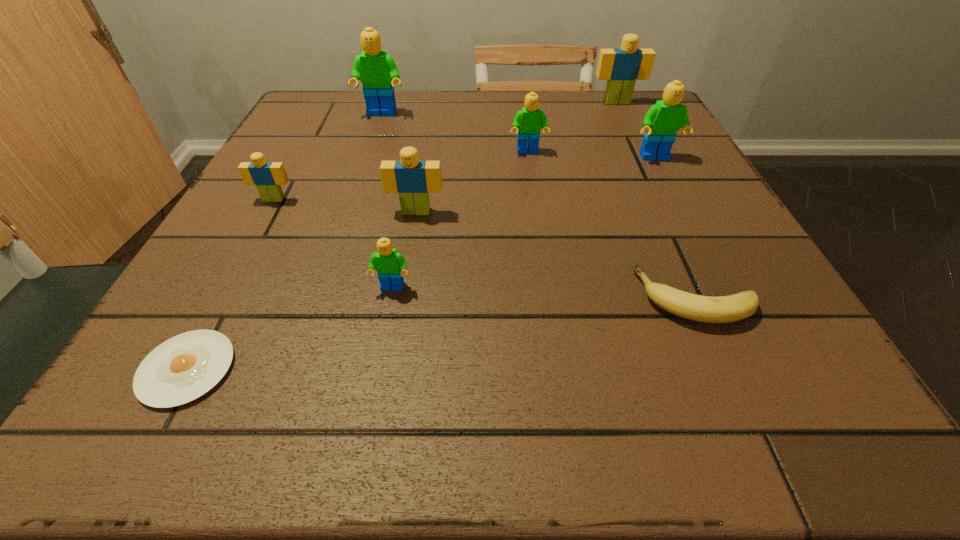
Where is `object situated at the near left corner`? The image size is (960, 540). object situated at the near left corner is located at coordinates (183, 368).

Image resolution: width=960 pixels, height=540 pixels. Find the location of `object that is at the far right corner`. object that is at the far right corner is located at coordinates (621, 67).

Find the location of a particular element. The height and width of the screenshot is (540, 960). vacant space at the far edge of the desktop is located at coordinates (416, 132).

Identify the location of free space at the near edge of the desktop. (638, 420).

The width and height of the screenshot is (960, 540). I want to click on free space at the right edge, so click(780, 319).

At what (x,y) coordinates should I click in order to perform the action: click on vacant space at the far left corner of the desktop. Please return your answer as a coordinate pair (x, y). This screenshot has width=960, height=540. Looking at the image, I should click on (343, 116).

Where is `vacant position at the near left corner of the desktop`? This screenshot has width=960, height=540. vacant position at the near left corner of the desktop is located at coordinates (135, 405).

Image resolution: width=960 pixels, height=540 pixels. In order to click on vacant space at the far right corner of the desktop in this screenshot , I will do `click(626, 111)`.

Find the location of a particular element. The width and height of the screenshot is (960, 540). vacant point at the near right corner is located at coordinates (726, 402).

In order to click on vacant space in between the rightmost green Lego and the farthest object in this screenshot , I will do `click(636, 130)`.